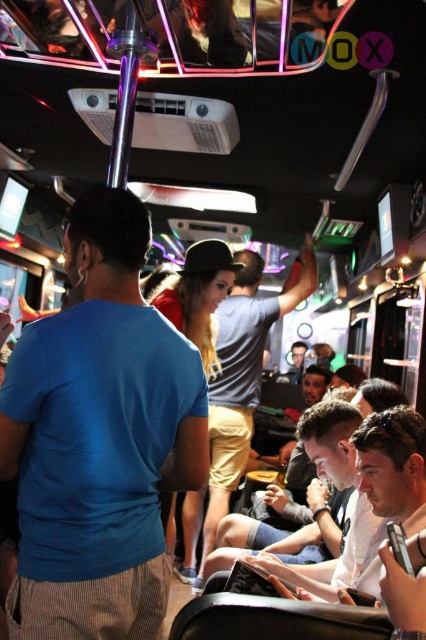
You are organizing a photo shoot and need to ensure that the blue cotton shirt at center and the matte black hat at center are visible in the frame. Given their sizes, which item might require more strategic placement to avoid being obscured by other elements?

The blue cotton shirt at center is thinner than the matte black hat at center, so the blue cotton shirt at center might require more strategic placement to avoid being obscured by other elements because it is thinner and could be hidden more easily.

You are standing at the entrance of the party bus and want to find the blue cotton shirt at center. According to the coordinates provided, in which direction should you look to locate it?

The blue cotton shirt at center is located at point 0.686 on the x and 0.232 on the y. Since the entrance is typically at the front of the bus, you should look towards the center area slightly to the right and forward to find it.

You are organizing a photo shoot inside the party bus and need to position a large camera tripod. The tripod requires a space larger than the area occupied by the blue cotton shirt at center. Can the matte black hat at center provide enough space for the tripod?

The blue cotton shirt at center occupies less space than matte black hat at center, so the matte black hat at center provides enough space for the tripod.